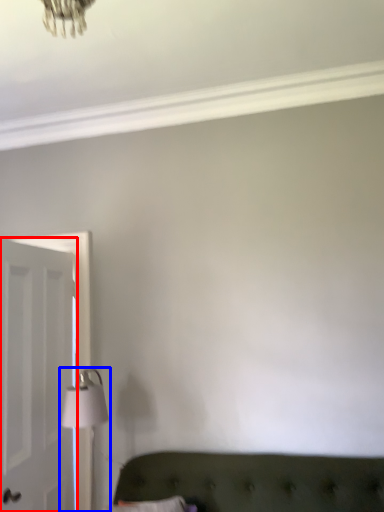
Question: Among these objects, which one is nearest to the camera, door (highlighted by a red box) or table lamp (highlighted by a blue box)?

Choices:
 (A) door
 (B) table lamp

Answer: (A)